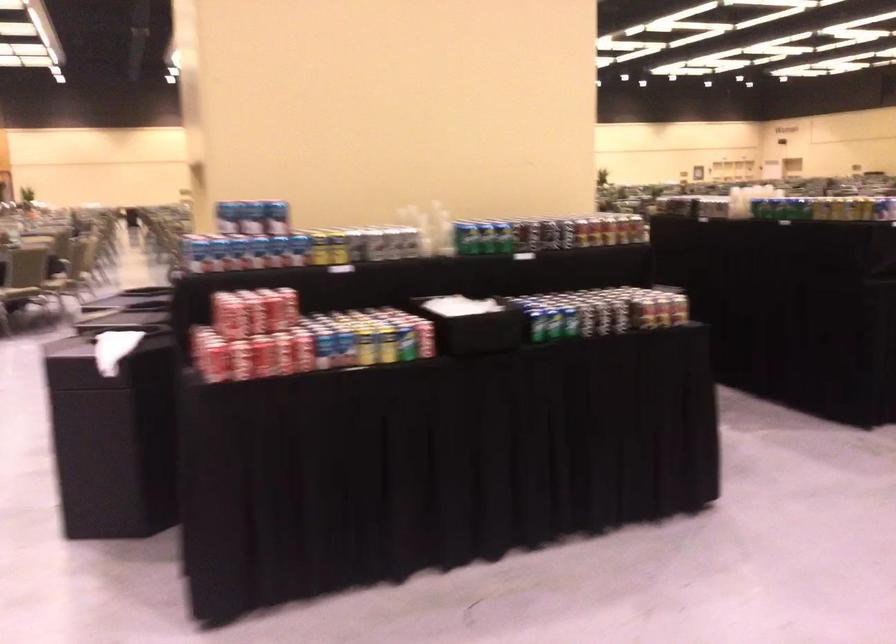
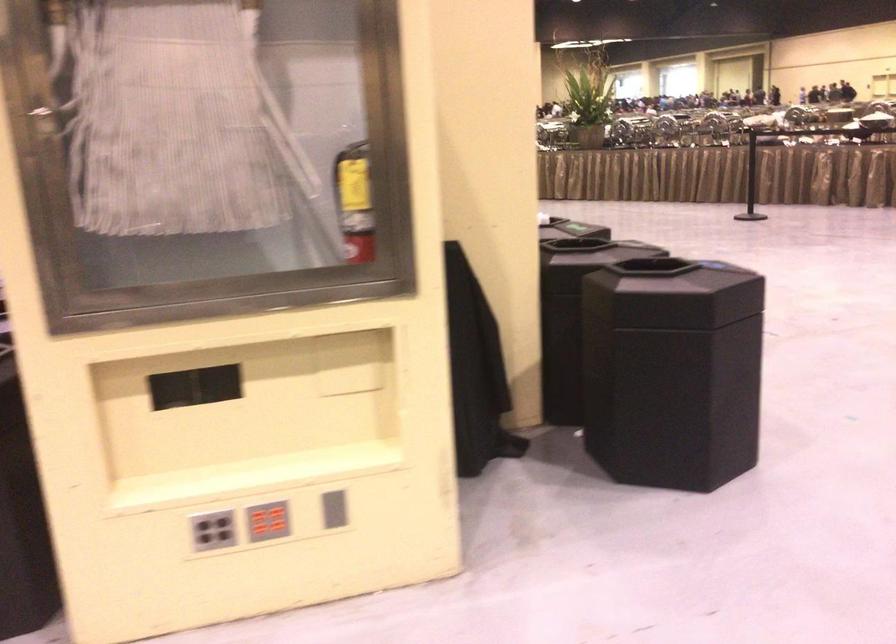
Question: I am providing you with two images of the same scene from different viewpoints. Which of the following objects are not visible in image2?

Choices:
 (A) grey button panel
 (B) polka-dot container
 (C) red soda can
 (D) black trash can lid

Answer: (C)